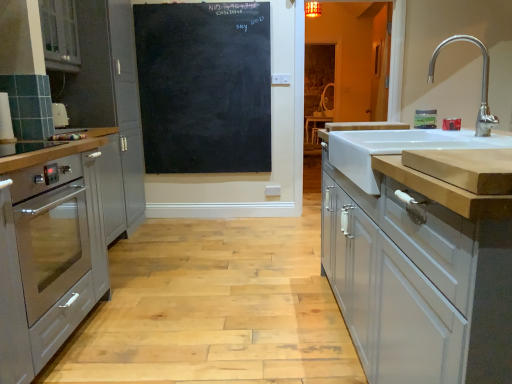
Question: Is the position of white glossy cabinet at upper left, the 4th cabinetry from the right, more distant than that of satin silver oven at left, arranged as the 3th cabinetry when viewed from the right?

Choices:
 (A) yes
 (B) no

Answer: (B)

Question: Is white glossy cabinet at upper left, marked as the first cabinetry in a left-to-right arrangement, wider than satin silver oven at left, the second cabinetry in the left-to-right sequence?

Choices:
 (A) yes
 (B) no

Answer: (B)

Question: Can you confirm if white glossy cabinet at upper left, marked as the first cabinetry in a left-to-right arrangement, is positioned to the left of satin silver oven at left, arranged as the 3th cabinetry when viewed from the right?

Choices:
 (A) yes
 (B) no

Answer: (A)

Question: Is white glossy cabinet at upper left, marked as the first cabinetry in a left-to-right arrangement, thinner than satin silver oven at left, the second cabinetry in the left-to-right sequence?

Choices:
 (A) no
 (B) yes

Answer: (B)

Question: Can you confirm if white glossy cabinet at upper left, the 4th cabinetry from the right, is shorter than satin silver oven at left, the second cabinetry in the left-to-right sequence?

Choices:
 (A) yes
 (B) no

Answer: (A)

Question: From a real-world perspective, is white glossy cabinet at upper left, marked as the first cabinetry in a left-to-right arrangement, located higher than satin silver oven at left, the second cabinetry in the left-to-right sequence?

Choices:
 (A) yes
 (B) no

Answer: (A)

Question: Is stainless steel oven at left in front of satin silver oven at left, the second cabinetry in the left-to-right sequence?

Choices:
 (A) no
 (B) yes

Answer: (B)

Question: Is stainless steel oven at left turned away from satin silver oven at left, the second cabinetry in the left-to-right sequence?

Choices:
 (A) no
 (B) yes

Answer: (A)

Question: Is stainless steel oven at left smaller than satin silver oven at left, arranged as the 3th cabinetry when viewed from the right?

Choices:
 (A) no
 (B) yes

Answer: (B)

Question: Does stainless steel oven at left have a greater width compared to satin silver oven at left, arranged as the 3th cabinetry when viewed from the right?

Choices:
 (A) no
 (B) yes

Answer: (A)

Question: From a real-world perspective, does stainless steel oven at left sit lower than satin silver oven at left, arranged as the 3th cabinetry when viewed from the right?

Choices:
 (A) yes
 (B) no

Answer: (A)

Question: Is satin silver oven at left, the second cabinetry in the left-to-right sequence, completely or partially inside stainless steel oven at left?

Choices:
 (A) yes
 (B) no

Answer: (B)

Question: Are stainless steel oven at left and white ceramic sink at right making contact?

Choices:
 (A) no
 (B) yes

Answer: (A)